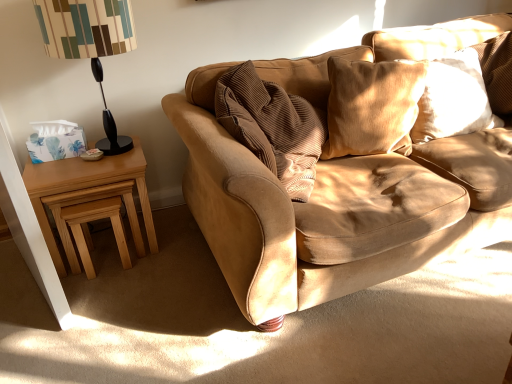
Question: From a real-world perspective, is black plastic table lamp at left located higher than suede cushion at upper right, the second pillow when ordered from right to left?

Choices:
 (A) yes
 (B) no

Answer: (A)

Question: Does black plastic table lamp at left have a greater height compared to suede cushion at upper right, the second pillow when ordered from right to left?

Choices:
 (A) yes
 (B) no

Answer: (A)

Question: Considering the relative sizes of black plastic table lamp at left and suede cushion at upper right, the second pillow when ordered from right to left, in the image provided, is black plastic table lamp at left thinner than suede cushion at upper right, the second pillow when ordered from right to left,?

Choices:
 (A) yes
 (B) no

Answer: (B)

Question: Is black plastic table lamp at left to the left of suede cushion at upper right, marked as the first pillow in a left-to-right arrangement, from the viewer's perspective?

Choices:
 (A) no
 (B) yes

Answer: (B)

Question: From a real-world perspective, is black plastic table lamp at left located beneath suede cushion at upper right, the second pillow when ordered from right to left?

Choices:
 (A) yes
 (B) no

Answer: (B)

Question: Is point (64, 271) positioned closer to the camera than point (385, 114)?

Choices:
 (A) closer
 (B) farther

Answer: (B)

Question: In terms of size, does light brown wood nesting tables at left appear bigger or smaller than suede cushion at upper right, the second pillow when ordered from right to left?

Choices:
 (A) small
 (B) big

Answer: (B)

Question: Is light brown wood nesting tables at left in front of or behind suede cushion at upper right, the second pillow when ordered from right to left, in the image?

Choices:
 (A) behind
 (B) front

Answer: (A)

Question: Choose the correct answer: Is light brown wood nesting tables at left inside suede cushion at upper right, the second pillow when ordered from right to left, or outside it?

Choices:
 (A) inside
 (B) outside

Answer: (B)

Question: Is light brown wooden stool at lower left spatially inside suede cushion at upper right, marked as the first pillow in a left-to-right arrangement, or outside of it?

Choices:
 (A) inside
 (B) outside

Answer: (B)

Question: From a real-world perspective, relative to suede cushion at upper right, the second pillow when ordered from right to left, is light brown wooden stool at lower left vertically above or below?

Choices:
 (A) below
 (B) above

Answer: (A)

Question: From the image's perspective, is light brown wooden stool at lower left located above or below suede cushion at upper right, marked as the first pillow in a left-to-right arrangement?

Choices:
 (A) above
 (B) below

Answer: (B)

Question: In the image, is light brown wooden stool at lower left positioned in front of or behind suede cushion at upper right, marked as the first pillow in a left-to-right arrangement?

Choices:
 (A) front
 (B) behind

Answer: (B)

Question: Is light brown wood nesting tables at left bigger or smaller than black plastic table lamp at left?

Choices:
 (A) small
 (B) big

Answer: (B)

Question: From the image's perspective, is light brown wood nesting tables at left located above or below black plastic table lamp at left?

Choices:
 (A) above
 (B) below

Answer: (B)